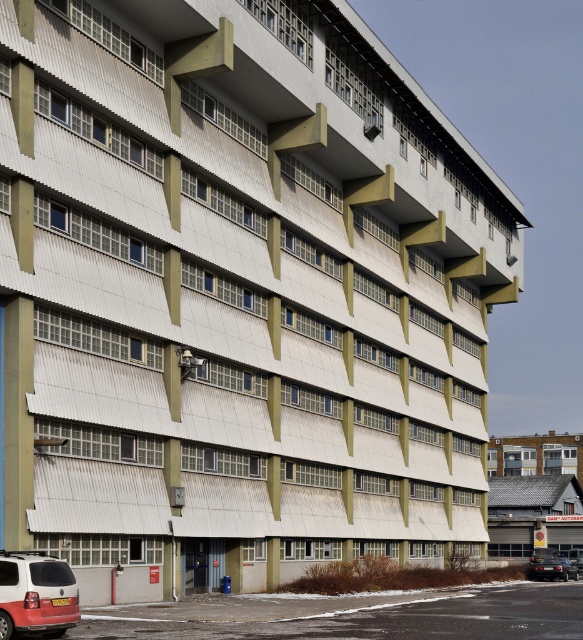
You are a delivery driver who needs to park your vehicle in the industrial area shown in the image. You have a truck that is 7 meters long. There is a space between the white matte van at lower left and the shiny black sedan at lower right. Can your truck fit in that space?

The white matte van at lower left and shiny black sedan at lower right are 66.22 meters apart from each other. Since your truck is only 7 meters long, it can easily fit in the space between them.

You are a delivery person who needs to park your vehicle in the industrial area shown. You have two options for parking spots next to the building. The first spot is next to the white matte van at lower left, and the second is next to the matte white van at lower right. Which parking spot will allow you to fit a wider vehicle?

The parking spot next to the matte white van at lower right will accommodate a wider vehicle since the matte white van at lower right is wider than the white matte van at lower left.

You are a delivery driver who needs to park your vehicle in the industrial area shown. You have a white matte van at lower left and a shiny black sedan at lower right. Which vehicle takes up more space when parked?

The white matte van at lower left takes up more space when parked because it is bigger than the shiny black sedan at lower right.